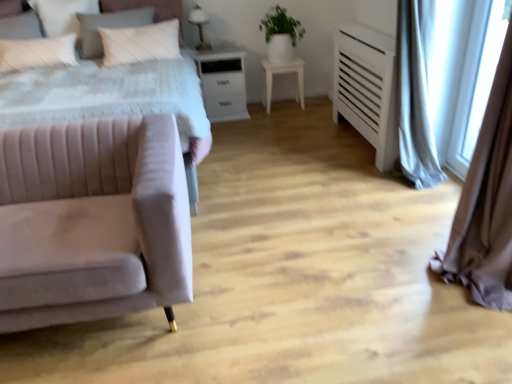
Find the location of a particular element. Image resolution: width=512 pixels, height=384 pixels. spots to the right of white glossy nightstand at center is located at coordinates (267, 114).